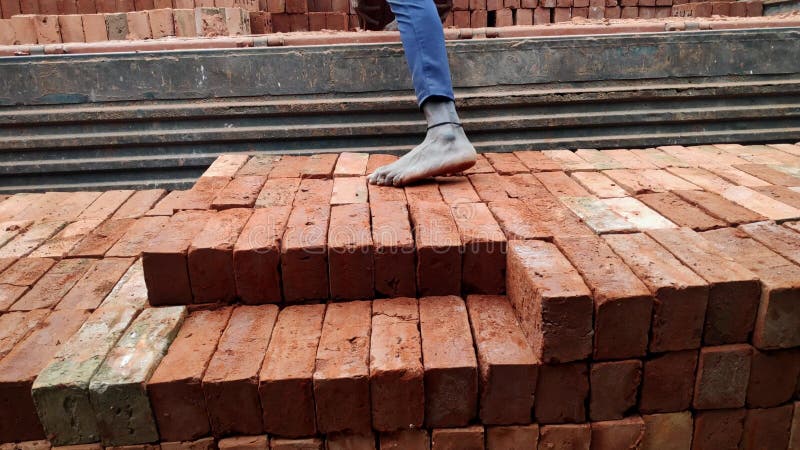
Identify the location of beam. The height and width of the screenshot is (450, 800). (529, 46).